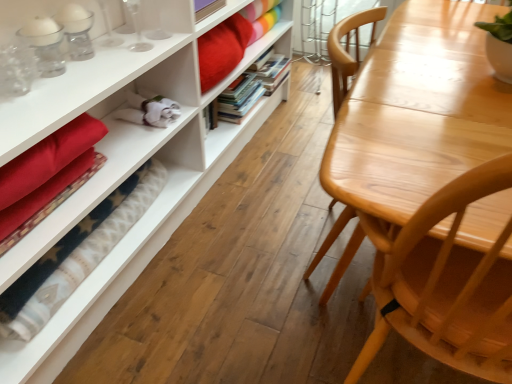
You are a GUI agent. You are given a task and a screenshot of the screen. Output one action in this format:
    pyautogui.click(x=<x>, y=<y>)
    Task: Click on the free space to the left of light wood table at right
    The width and height of the screenshot is (512, 384).
    Given the screenshot: What is the action you would take?
    pyautogui.click(x=252, y=257)